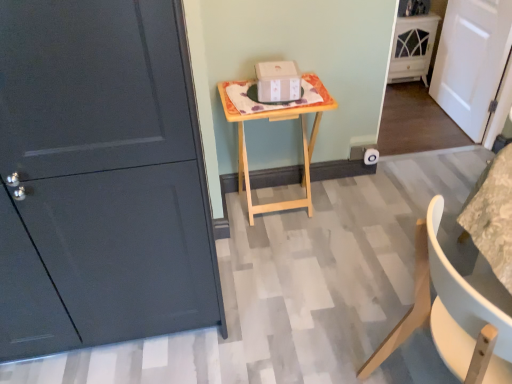
Question: Is white matte chair at lower right situated inside white matte door at right, which is the 2th door from left to right, or outside?

Choices:
 (A) outside
 (B) inside

Answer: (A)

Question: Considering the positions of white matte chair at lower right and white matte door at right, the 1th door when ordered from right to left, in the image, is white matte chair at lower right taller or shorter than white matte door at right, the 1th door when ordered from right to left,?

Choices:
 (A) short
 (B) tall

Answer: (A)

Question: Which is nearer to the white glossy cabinet at upper right?

Choices:
 (A) natural wood table at center
 (B) white matte door at right, the second door when ordered from front to back
 (C) matte dark gray door at left, which is the 2th door from right to left
 (D) white cardboard box at center
 (E) white matte chair at lower right

Answer: (B)

Question: Estimate the real-world distances between objects in this image. Which object is closer to the natural wood table at center?

Choices:
 (A) white matte chair at lower right
 (B) white matte door at right, the second door when ordered from front to back
 (C) white cardboard box at center
 (D) matte dark gray door at left, the first door from the front
 (E) white glossy cabinet at upper right

Answer: (C)